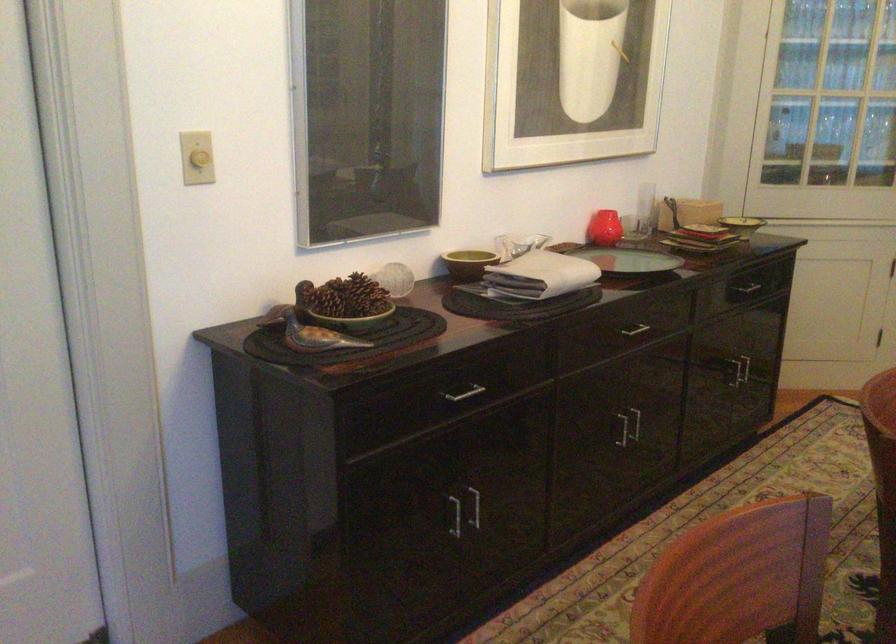
The location [630,261] corresponds to which object?

It corresponds to the green glass plate in the image.